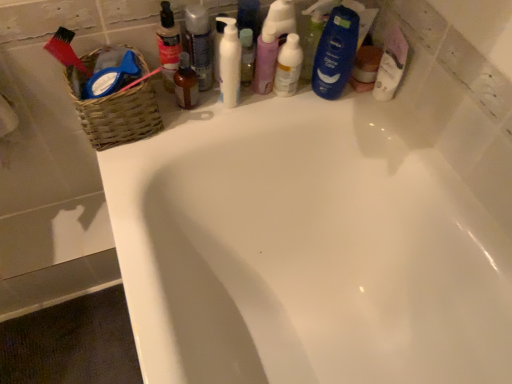
Locate an element on the screen. Image resolution: width=512 pixels, height=384 pixels. empty space that is to the right of purple matte lotion at center, which is the 4th toiletry in left-to-right order is located at coordinates (323, 98).